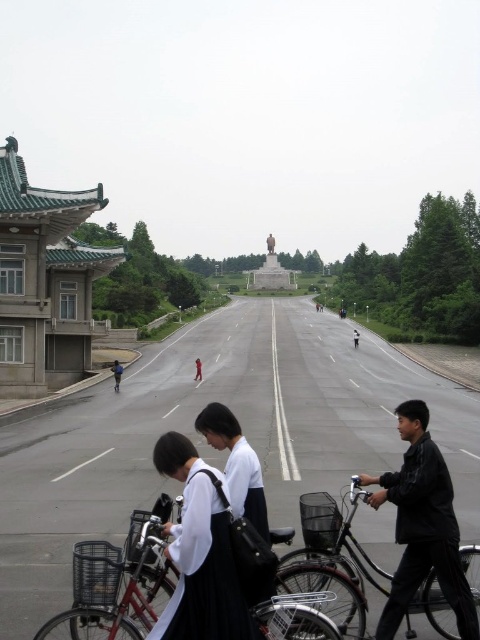
You are a photographer standing at the edge of the road. You want to take a photo of the silver metallic bicycle at lower center and the white matte uniform at center. Which object appears narrower in the photo?

The silver metallic bicycle at lower center appears narrower because it is thinner than the white matte uniform at center.